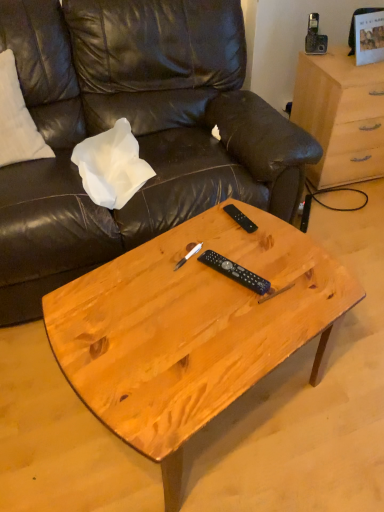
Identify the location of unoccupied region to the right of black plastic remote at center, the 1th remote positioned from the bottom. The height and width of the screenshot is (512, 384). (291, 275).